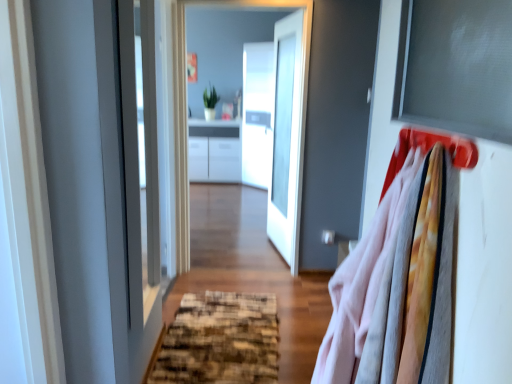
Question: Would you say white glossy door at center is a long distance from matte plastic hanger at upper right?

Choices:
 (A) yes
 (B) no

Answer: (A)

Question: Can we say white glossy door at center lies outside matte plastic hanger at upper right?

Choices:
 (A) no
 (B) yes

Answer: (B)

Question: Could matte plastic hanger at upper right be considered to be inside white glossy door at center?

Choices:
 (A) yes
 (B) no

Answer: (B)

Question: Can you confirm if white glossy door at center is bigger than matte plastic hanger at upper right?

Choices:
 (A) yes
 (B) no

Answer: (A)

Question: Can you confirm if white glossy door at center is thinner than matte plastic hanger at upper right?

Choices:
 (A) yes
 (B) no

Answer: (B)

Question: Is white glossy door at center touching matte plastic hanger at upper right?

Choices:
 (A) yes
 (B) no

Answer: (B)

Question: Is matte plastic hanger at upper right outside of matte gray window screen at upper right?

Choices:
 (A) no
 (B) yes

Answer: (B)

Question: From the image's perspective, is matte plastic hanger at upper right located above matte gray window screen at upper right?

Choices:
 (A) yes
 (B) no

Answer: (B)

Question: From the image's perspective, does matte plastic hanger at upper right appear lower than matte gray window screen at upper right?

Choices:
 (A) no
 (B) yes

Answer: (B)

Question: Is matte plastic hanger at upper right not close to matte gray window screen at upper right?

Choices:
 (A) yes
 (B) no

Answer: (B)

Question: Does matte plastic hanger at upper right have a greater width compared to matte gray window screen at upper right?

Choices:
 (A) yes
 (B) no

Answer: (A)

Question: Is matte plastic hanger at upper right to the left of matte gray window screen at upper right from the viewer's perspective?

Choices:
 (A) yes
 (B) no

Answer: (A)

Question: From the image's perspective, is matte gray window screen at upper right located beneath matte plastic hanger at upper right?

Choices:
 (A) no
 (B) yes

Answer: (A)